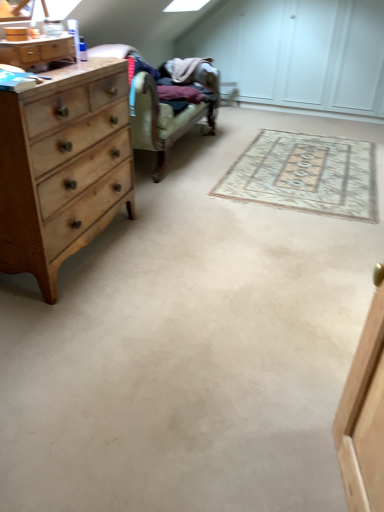
This screenshot has height=512, width=384. Find the location of `vacant space situated above wooden dresser at left (from a real-world perspective)`. vacant space situated above wooden dresser at left (from a real-world perspective) is located at coordinates (40, 34).